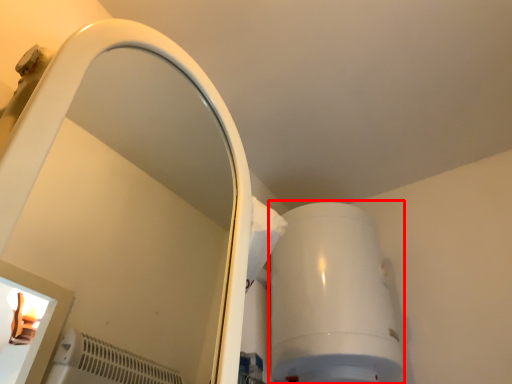
Question: From the image's perspective, what is the correct spatial positioning of appliance (annotated by the red box) in reference to mirror?

Choices:
 (A) below
 (B) above

Answer: (A)